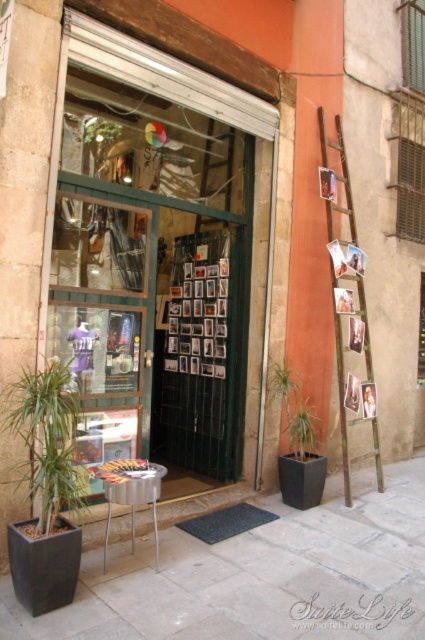
Question: Which is farther from the rustic wooden ladder at right?

Choices:
 (A) green matte plant at center
 (B) transparent glass door at center
 (C) smooth stone pavement at center
 (D) green leafy plant at center

Answer: (B)

Question: From the image, what is the correct spatial relationship of transparent glass door at center in relation to green leafy plant at center?

Choices:
 (A) left
 (B) right

Answer: (A)

Question: Estimate the real-world distances between objects in this image. Which object is farther from the transparent glass door at center?

Choices:
 (A) rustic wooden ladder at right
 (B) green matte plant at center
 (C) green leafy plant at lower left
 (D) smooth stone pavement at center

Answer: (D)

Question: Which object is positioned farthest from the green matte plant at center?

Choices:
 (A) transparent glass door at center
 (B) green leafy plant at center
 (C) rustic wooden ladder at right
 (D) green leafy plant at lower left

Answer: (D)

Question: Does smooth stone pavement at center have a lesser width compared to green leafy plant at lower left?

Choices:
 (A) yes
 (B) no

Answer: (B)

Question: Does transparent glass door at center appear on the right side of green leafy plant at center?

Choices:
 (A) yes
 (B) no

Answer: (B)